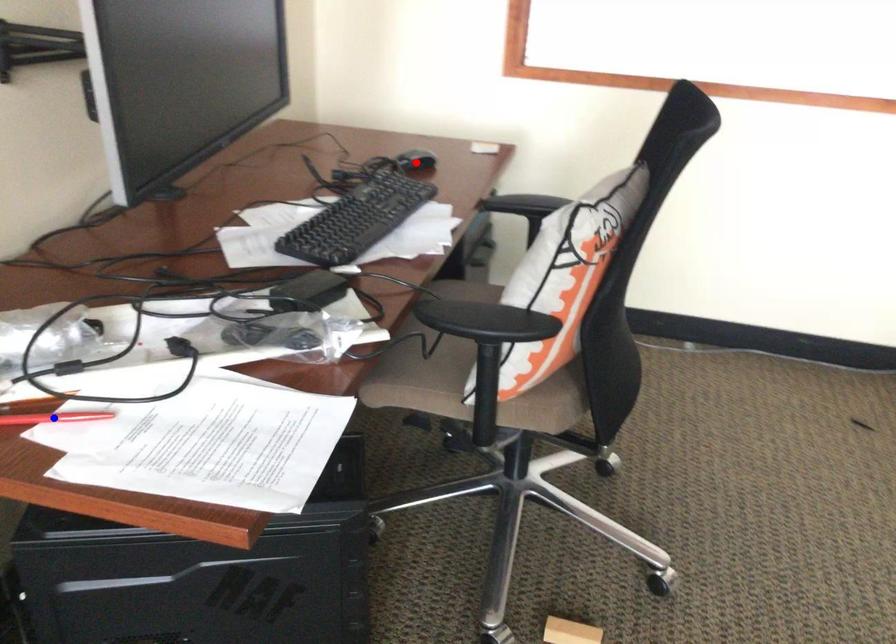
Question: Two points are marked on the image. Which point is closer to the camera?

Choices:
 (A) Blue point is closer.
 (B) Red point is closer.

Answer: (A)